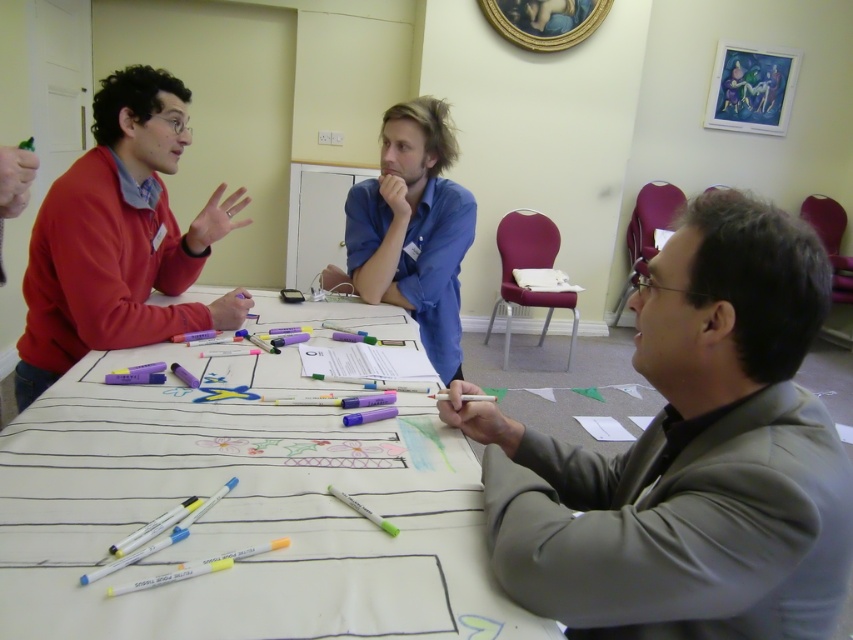
Question: Is white paper at center above gray suit jacket at lower right?

Choices:
 (A) yes
 (B) no

Answer: (A)

Question: Is gray suit jacket at lower right to the left of matte red sweater at left from the viewer's perspective?

Choices:
 (A) no
 (B) yes

Answer: (A)

Question: Which point is closer to the camera?

Choices:
 (A) white paper at center
 (B) matte red sweater at left

Answer: (A)

Question: Which point appears closest to the camera in this image?

Choices:
 (A) (328, 340)
 (B) (703, 404)

Answer: (B)

Question: Which object is closer to the camera taking this photo?

Choices:
 (A) blue cotton shirt at center
 (B) white paper at center

Answer: (B)

Question: Is white paper at center bigger than gray suit jacket at lower right?

Choices:
 (A) no
 (B) yes

Answer: (B)